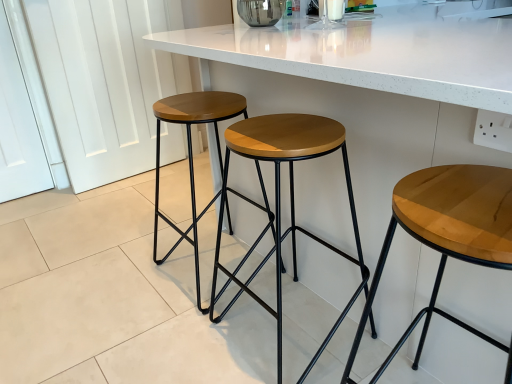
You are a GUI agent. You are given a task and a screenshot of the screen. Output one action in this format:
    pyautogui.click(x=<x>, y=<y>)
    Task: Click on the empty space that is ontop of woodenmaterial/texturestool at center, the 2th stool when ordered from left to right
    
    Given the screenshot: What is the action you would take?
    pyautogui.click(x=284, y=129)